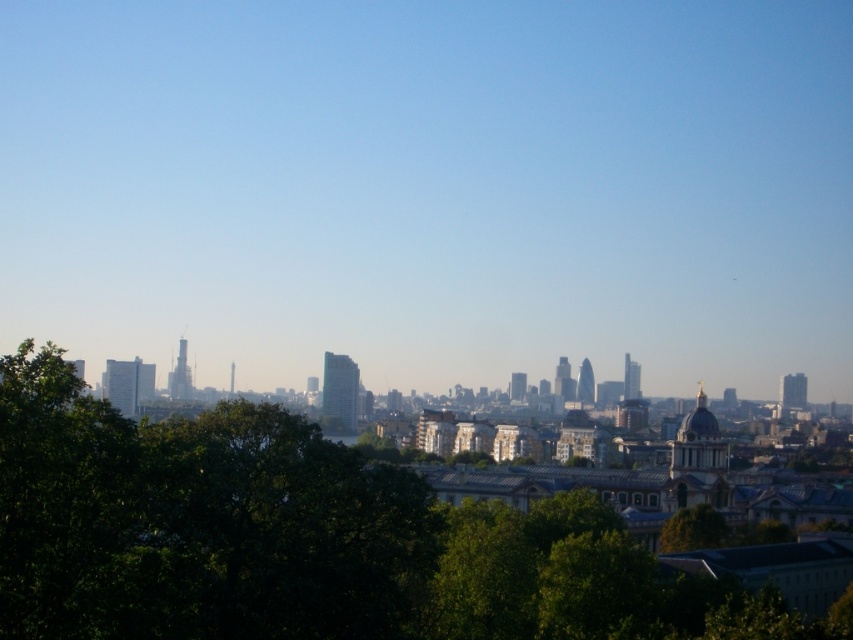
You are a drone operator trying to navigate between two points in a city. You see the point at coordinates point [167,552] and the point at coordinates point [680,532]. Which point is closer to the city skyline in the background?

Point [167,552] is behind point [680,532], so it is closer to the city skyline in the background.

You are standing in the city park and want to take a photo of the city skyline. You notice two green leafy trees in your viewfinder. The green leafy tree at lower left and the green leafy tree at center. Which tree is closer to the camera?

The green leafy tree at lower left is closer to the camera because it is positioned below the green leafy tree at center, indicating it is in a lower and nearer position in the scene.

You are standing in the city park and see the point marked at coordinates (302, 538). Which object in the scene does this point belong to?

The point at coordinates (302, 538) belongs to the green leafy tree at lower left.